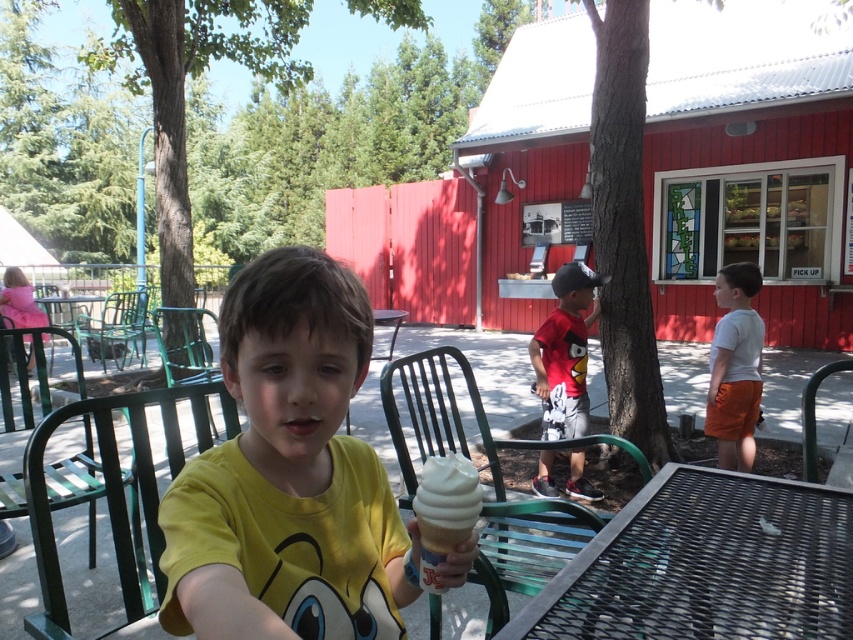
Which is in front, point (534, 534) or point (108, 458)?

Positioned in front is point (108, 458).

Based on the photo, who is more distant from viewer, (511, 552) or (114, 509)?

Point (511, 552)

Identify the location of green metal chair at lower center. The width and height of the screenshot is (853, 640). (492, 480).

Is red cotton shirt at center thinner than green metal chair at left?

Yes.

How much distance is there between red cotton shirt at center and green metal chair at left?

A distance of 6.72 meters exists between red cotton shirt at center and green metal chair at left.

Locate an element on the screen. red cotton shirt at center is located at coordinates [x=566, y=352].

This screenshot has width=853, height=640. Describe the element at coordinates (184, 344) in the screenshot. I see `green metal chair at center` at that location.

Between point (206, 374) and point (71, 317), which one is positioned in front?

Point (206, 374) is in front.

Locate an element on the screen. The image size is (853, 640). green metal chair at center is located at coordinates (184, 344).